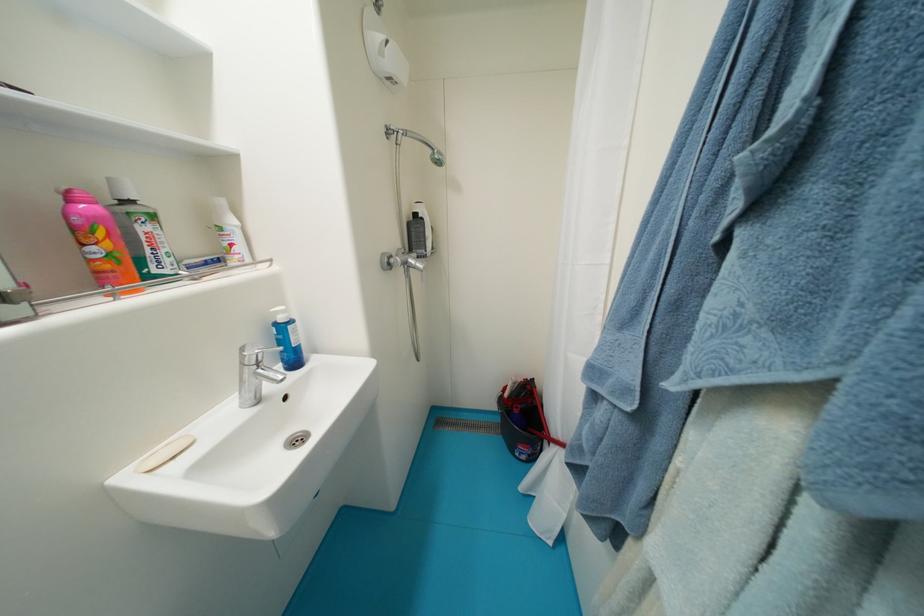
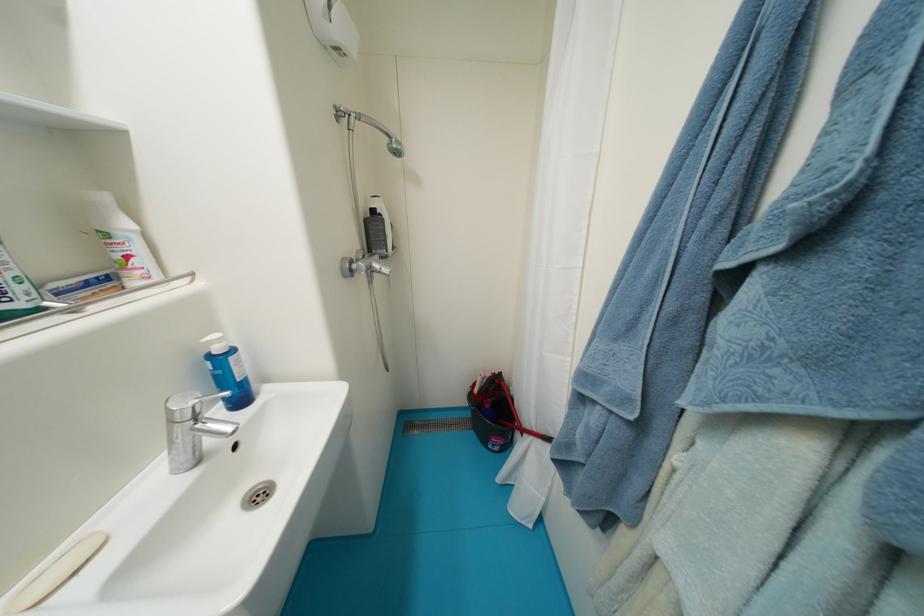
Question: The camera is either moving clockwise (left) or counter-clockwise (right) around the object. The first image is from the beginning of the video and the second image is from the end. Is the camera moving left or right when shooting the video?

Choices:
 (A) Left
 (B) Right

Answer: (A)